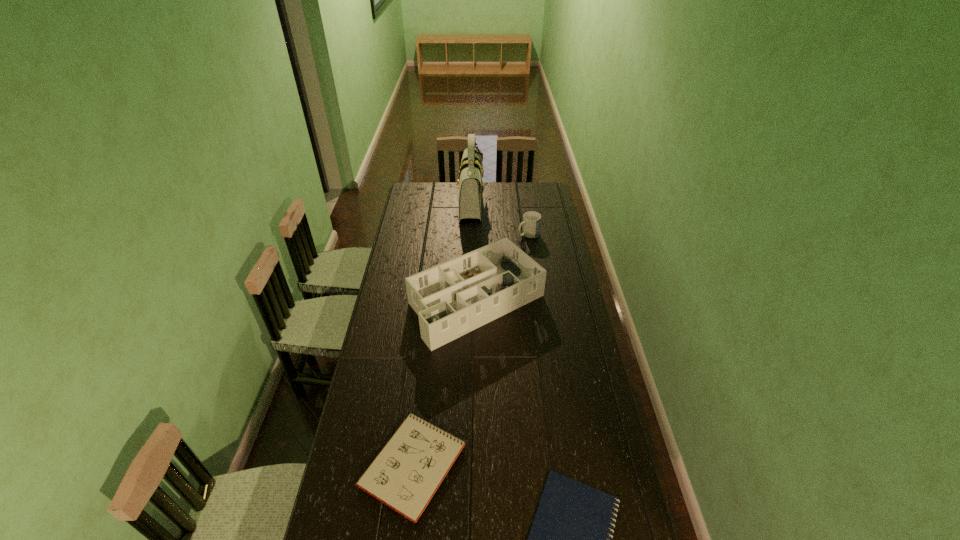
Image resolution: width=960 pixels, height=540 pixels. I want to click on the farthest object, so click(471, 187).

Locate an element on the screen. The height and width of the screenshot is (540, 960). the tallest object is located at coordinates (471, 187).

Locate an element on the screen. This screenshot has width=960, height=540. the third nearest object is located at coordinates (451, 299).

Locate an element on the screen. dollhouse is located at coordinates (451, 299).

This screenshot has height=540, width=960. Find the location of `mug`. mug is located at coordinates (531, 220).

Where is `the third shortest object`? the third shortest object is located at coordinates point(531,220).

Locate an element on the screen. the taller notepad is located at coordinates (405, 475).

I want to click on the left notepad, so (405, 475).

Identify the location of free space located on the front-facing side of the tallest object. This screenshot has height=540, width=960. (548, 202).

Locate an element on the screen. The image size is (960, 540). free point located 0.220m on the back of the third farthest object is located at coordinates (477, 233).